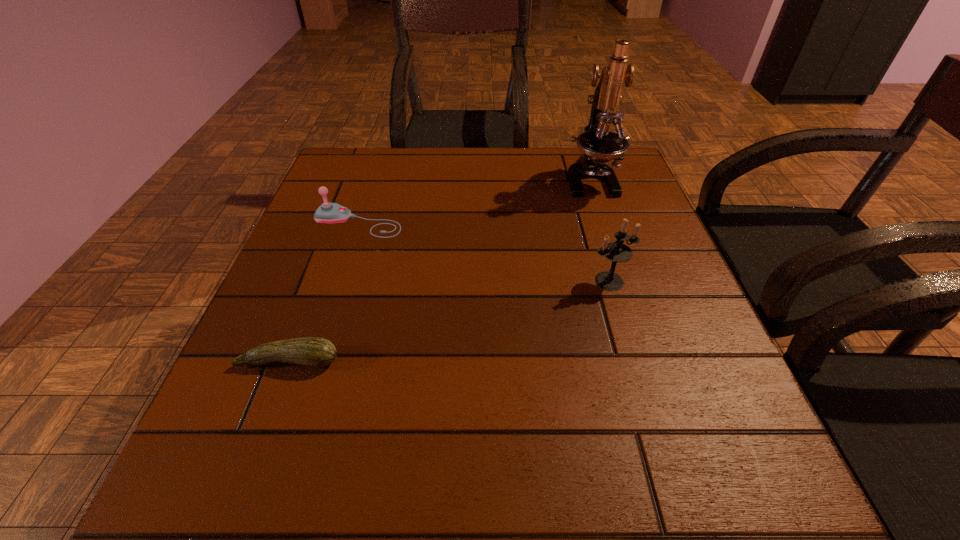
Find the location of a particular element. The image size is (960, 540). vacant area that lies between the second nearest object and the joystick is located at coordinates (484, 252).

Locate an element on the screen. Image resolution: width=960 pixels, height=540 pixels. vacant region between the tallest object and the third tallest object is located at coordinates (474, 201).

In order to click on unoccupied position between the second tallest object and the second farthest object in this screenshot , I will do (484, 252).

Locate an element on the screen. The image size is (960, 540). free space between the microscope and the shortest object is located at coordinates (440, 271).

This screenshot has height=540, width=960. I want to click on object that stands as the second closest to the shortest object, so click(x=616, y=251).

This screenshot has height=540, width=960. I want to click on object that is the closest one to the microscope, so click(616, 251).